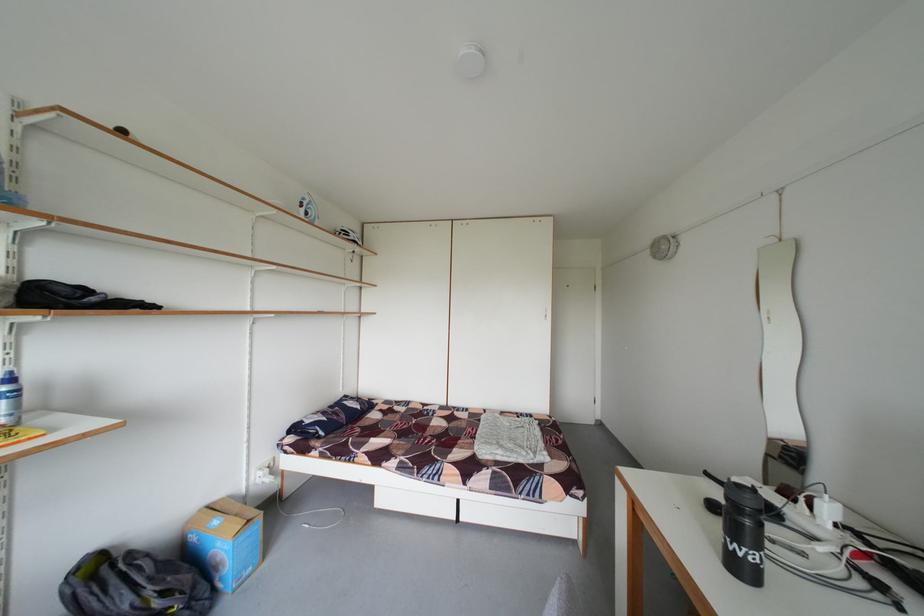
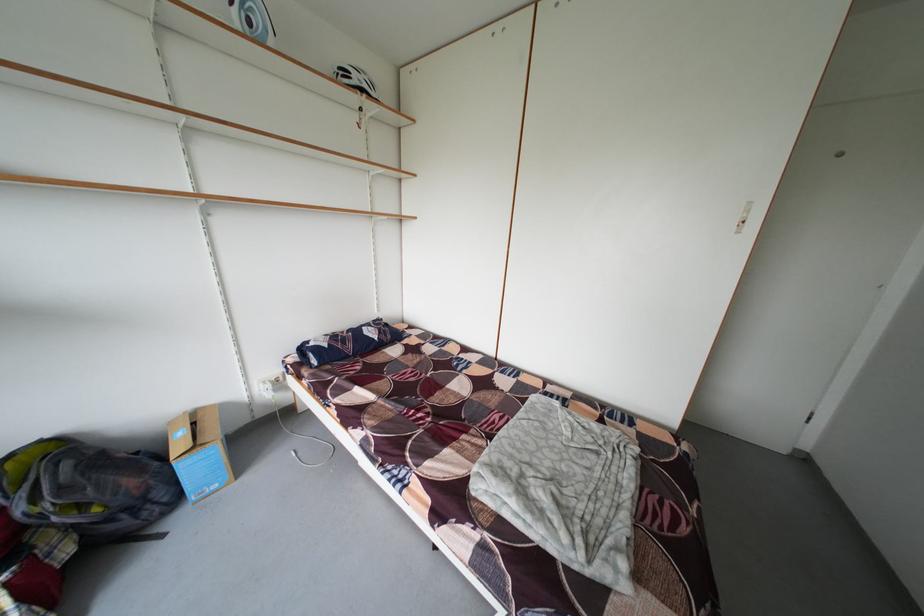
The point at (x=368, y=246) is marked in the first image. Where is the corresponding point in the second image?

(375, 92)